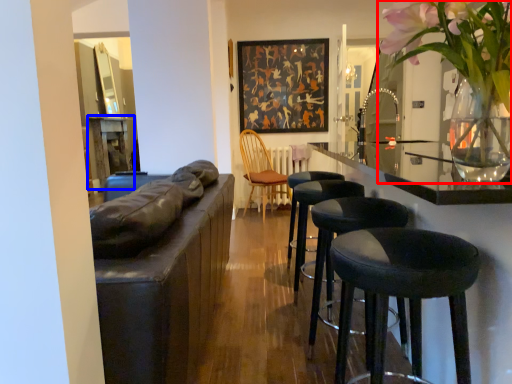
Question: Which object appears farthest to the camera in this image, floral arrangement (highlighted by a red box) or table (highlighted by a blue box)?

Choices:
 (A) floral arrangement
 (B) table

Answer: (B)